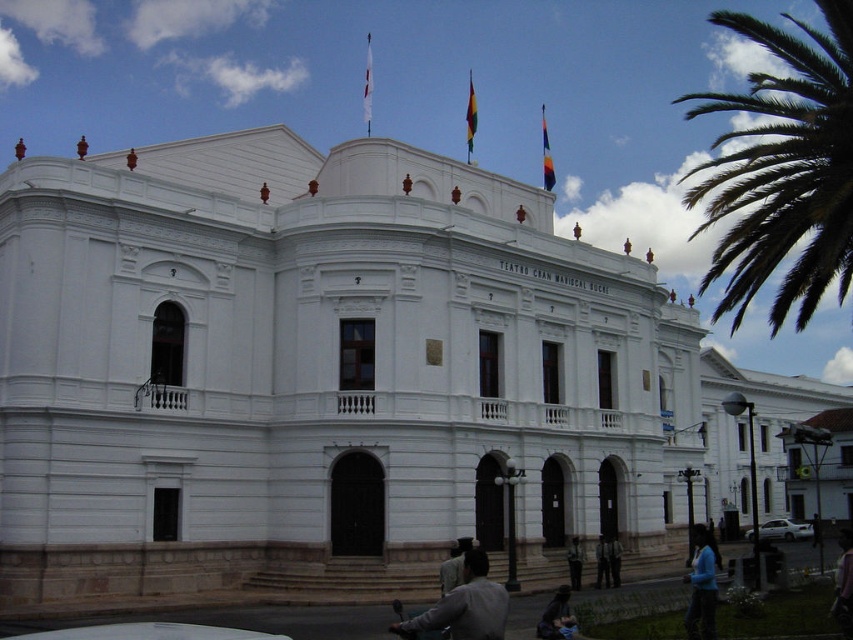
Question: Is blue fabric jacket at lower center behind red fabric flag at upper center?

Choices:
 (A) yes
 (B) no

Answer: (B)

Question: Can you confirm if gray fabric jacket at lower center is positioned above red fabric flag at upper center?

Choices:
 (A) no
 (B) yes

Answer: (A)

Question: Which point is farther from the camera taking this photo?

Choices:
 (A) (468, 88)
 (B) (572, 538)
 (C) (608, 557)

Answer: (A)

Question: Observing the image, what is the correct spatial positioning of green leafy palm at upper right in reference to silky yellow-green flag at upper center?

Choices:
 (A) below
 (B) above

Answer: (A)

Question: Which point is closer to the camera?

Choices:
 (A) (601, 540)
 (B) (544, 154)

Answer: (A)

Question: Among these points, which one is nearest to the camera?

Choices:
 (A) (582, 552)
 (B) (614, 541)

Answer: (A)